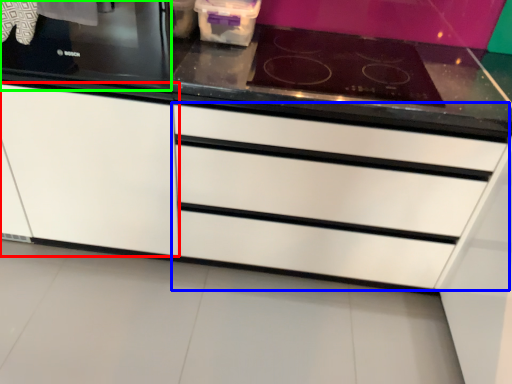
Question: Which is nearer to the cabinetry (highlighted by a red box)? drawer (highlighted by a blue box) or home appliance (highlighted by a green box).

Choices:
 (A) drawer
 (B) home appliance

Answer: (B)